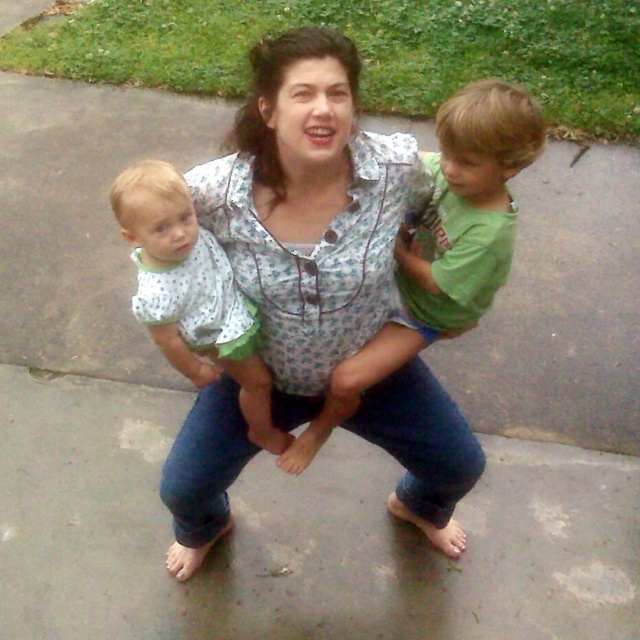
Question: Can you confirm if green cotton shirt at upper center is positioned to the right of polka dot fabric shirt at upper left?

Choices:
 (A) no
 (B) yes

Answer: (B)

Question: Which object is positioned farthest from the green cotton shirt at upper center?

Choices:
 (A) polka dot fabric shirt at upper left
 (B) floral shirt at center

Answer: (A)

Question: Does floral shirt at center have a smaller size compared to green cotton shirt at upper center?

Choices:
 (A) no
 (B) yes

Answer: (A)

Question: Which of these objects is positioned closest to the green cotton shirt at upper center?

Choices:
 (A) polka dot fabric shirt at upper left
 (B) floral shirt at center

Answer: (B)

Question: Observing the image, what is the correct spatial positioning of floral shirt at center in reference to green cotton shirt at upper center?

Choices:
 (A) below
 (B) above

Answer: (A)

Question: Among these points, which one is nearest to the camera?

Choices:
 (A) (193, 237)
 (B) (294, 225)
 (C) (480, 300)

Answer: (A)